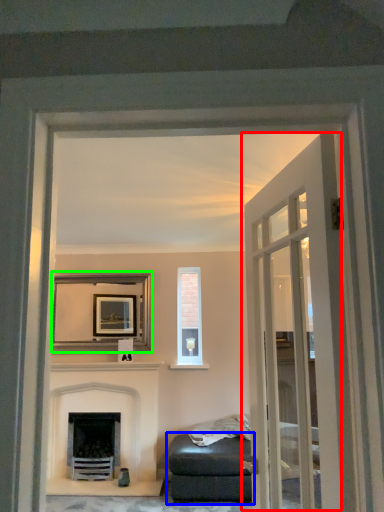
Question: Based on their relative distances, which object is nearer to door (highlighted by a red box)? Choose from studio couch (highlighted by a blue box) and picture frame (highlighted by a green box).

Choices:
 (A) studio couch
 (B) picture frame

Answer: (A)